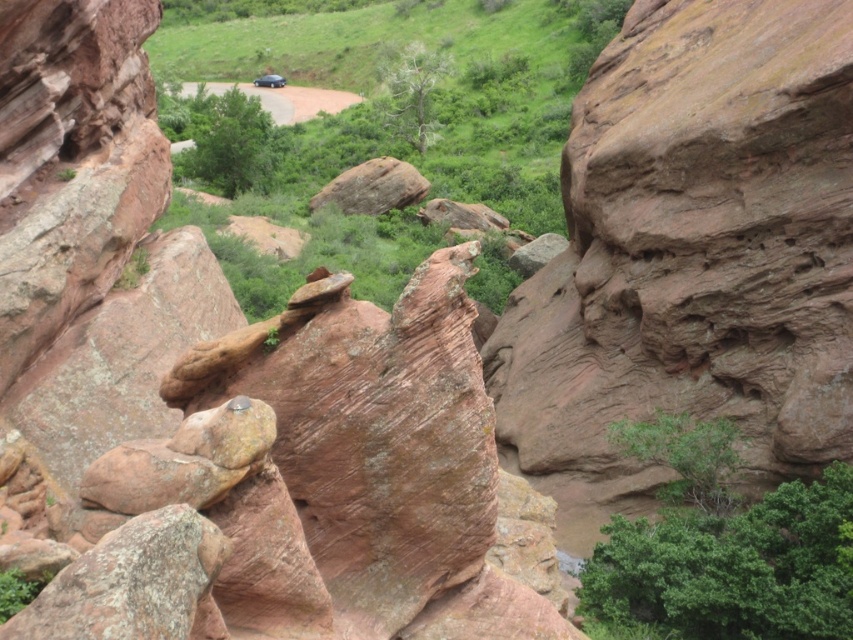
You are a hiker trying to cross the rugged landscape. You see a rusty stone boulder at center and a rusty rock at center. Which one has a larger width?

The rusty stone boulder at center might be wider than rusty rock at center according to the description.

You are standing at the origin point of the coordinate system in the image. Where is the rusty stone boulder at center located in terms of its 2D coordinates?

The rusty stone boulder at center is located at the 2D coordinates of point (225, 396).